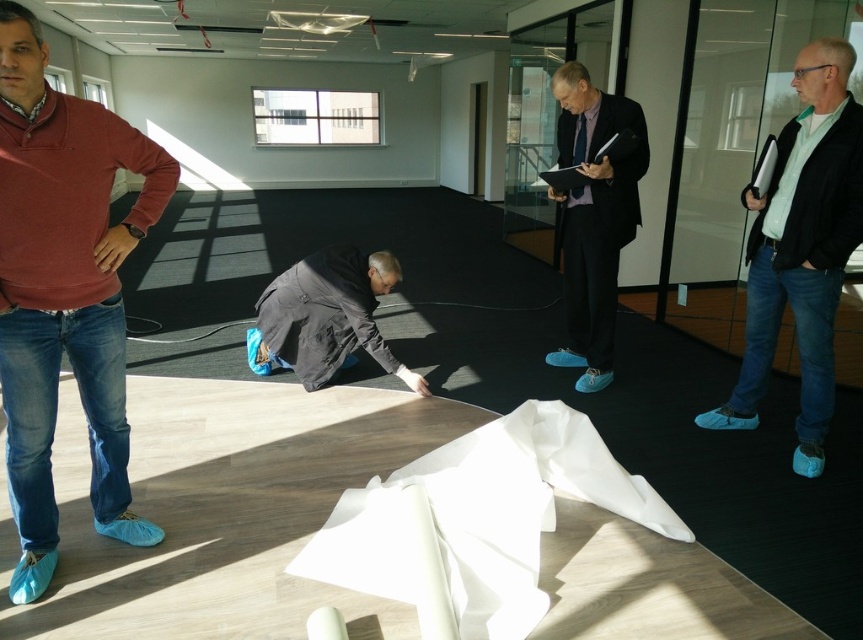
You are standing in the office and need to find the person wearing the blue suede shoes at right. Which direction should you look relative to the person in the matte red sweater at left?

The blue suede shoes at right are to the right of the matte red sweater at left, so you should look to the right of the person in the matte red sweater at left to find the blue suede shoes at right.

You are a delivery person who needs to place a 1.5 meter long package between the dark blue suit at center and the black matte jacket at center. Is there enough space between them to fit the package?

The dark blue suit at center and the black matte jacket at center are 1.30 meters apart from each other. Since the package is 1.5 meters long, which is longer than the space between them, the package cannot fit between them.

You are a photographer who needs to take a photo of the matte red sweater at left. The camera you are holding is 5.44 feet away from the sweater. Is this distance within the camera lens focus range of 5 feet to 6 feet?

The matte red sweater at left and camera are 5.44 feet apart from each other, which falls within the camera lens focus range of 5 feet to 6 feet. Therefore, the photographer can take a clear photo of the matte red sweater at left.